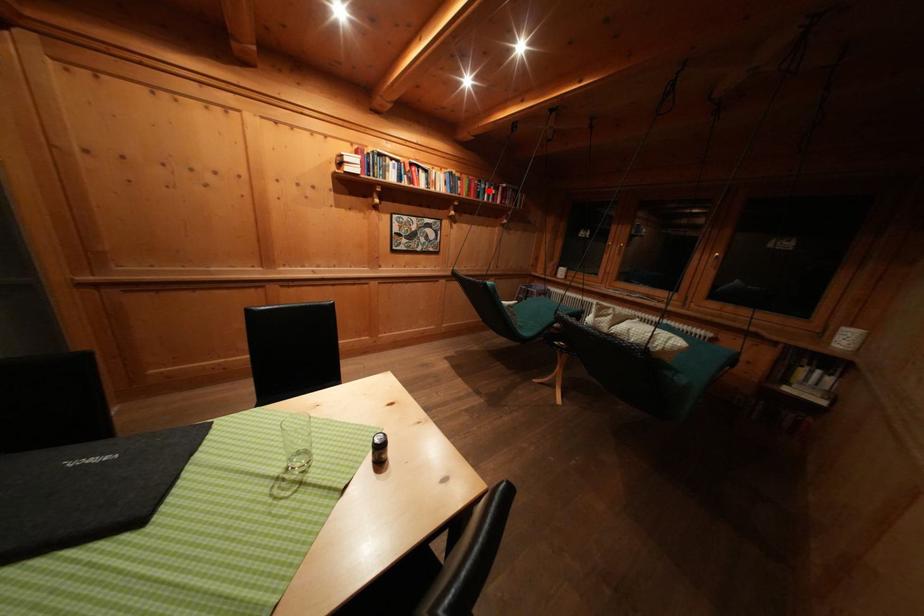
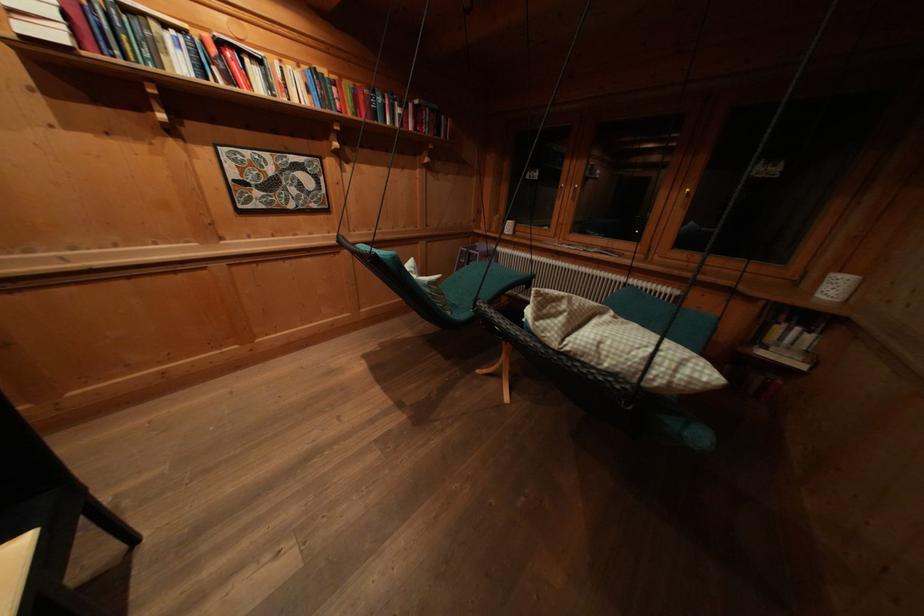
In the second image, find the point that corresponds to the highlighted location in the first image.

(385, 103)